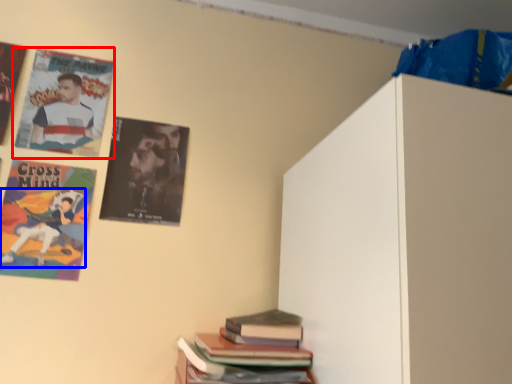
Question: Among these objects, which one is farthest to the camera, poster (highlighted by a red box) or person (highlighted by a blue box)?

Choices:
 (A) poster
 (B) person

Answer: (A)